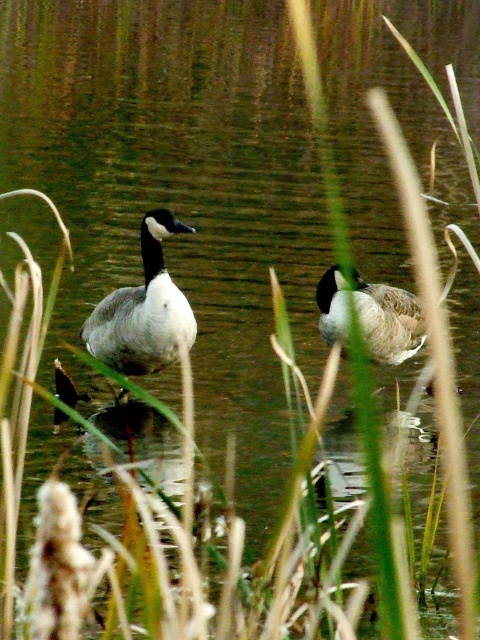
You are a wildlife photographer aiming to capture both the white matte duck at center and the gray matte duck at center in a single frame. Based on their positions, which duck is positioned closer to the center of the image?

Both the white matte duck at center and the gray matte duck at center are positioned at the center of the image, so they are equally close to the center.

You are a birdwatcher observing two ducks in a wetland. You notice a white matte duck at center and a gray matte duck at center. Which duck is located to the left of the other?

The white matte duck at center is positioned on the left side of the gray matte duck at center.